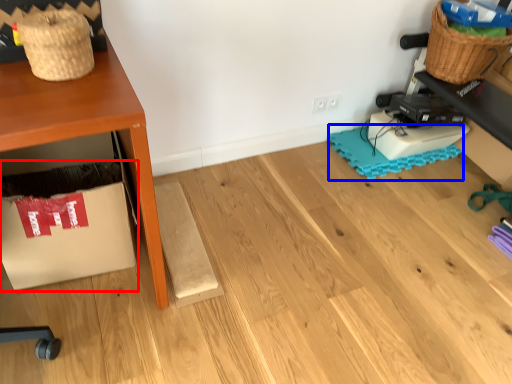
Question: Which object appears closest to the camera in this image, cardboard box (highlighted by a red box) or mat (highlighted by a blue box)?

Choices:
 (A) cardboard box
 (B) mat

Answer: (A)